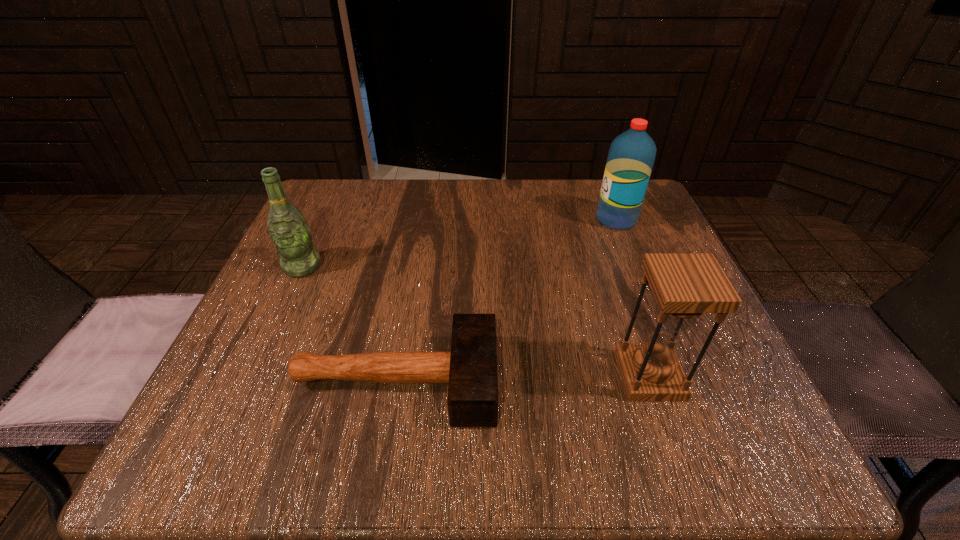
Image resolution: width=960 pixels, height=540 pixels. I want to click on vacant space positioned 0.140m on the back of the hourglass, so click(622, 295).

Find the location of a particular element. vacant area located 0.350m on the hammer head face of the shortest object is located at coordinates (717, 381).

The height and width of the screenshot is (540, 960). Identify the location of object positioned at the far edge. (631, 156).

Identify the location of object at the near edge. (470, 368).

Where is `beer bottle that is at the left edge`? The image size is (960, 540). beer bottle that is at the left edge is located at coordinates (288, 229).

I want to click on mallet that is at the left edge, so click(x=470, y=368).

I want to click on water bottle that is at the right edge, so click(x=631, y=156).

I want to click on hourglass that is at the right edge, so click(x=685, y=285).

You are a GUI agent. You are given a task and a screenshot of the screen. Output one action in this format:
    pyautogui.click(x=<x>, y=<y>)
    Task: Click on the object located at the near left corner
    The height and width of the screenshot is (540, 960).
    Given the screenshot: What is the action you would take?
    pyautogui.click(x=470, y=368)

I want to click on object present at the far right corner, so click(631, 156).